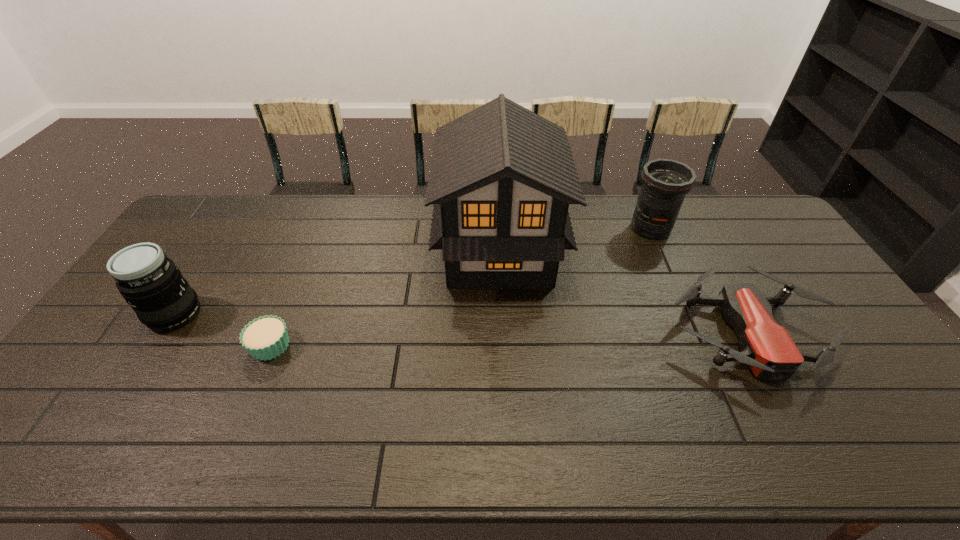
The width and height of the screenshot is (960, 540). In order to click on free space located on the front-facing side of the third object from left to right in this screenshot , I will do `click(408, 253)`.

Where is `blank space located on the right of the farther telephoto lens`? Image resolution: width=960 pixels, height=540 pixels. blank space located on the right of the farther telephoto lens is located at coordinates (716, 228).

Where is `vacant space situated 0.190m on the back of the leftmost object`? This screenshot has width=960, height=540. vacant space situated 0.190m on the back of the leftmost object is located at coordinates (213, 253).

The width and height of the screenshot is (960, 540). I want to click on free space located 0.090m on the front-facing side of the drone, so click(x=796, y=425).

Locate an element on the screen. The width and height of the screenshot is (960, 540). free region located 0.130m on the right of the second object from left to right is located at coordinates (340, 345).

Where is `dollhouse at the far edge`? The width and height of the screenshot is (960, 540). dollhouse at the far edge is located at coordinates (502, 177).

This screenshot has width=960, height=540. In order to click on telephoto lens that is at the far edge in this screenshot , I will do `click(665, 182)`.

The height and width of the screenshot is (540, 960). I want to click on object that is at the left edge, so [151, 283].

The width and height of the screenshot is (960, 540). Find the location of `object that is at the right edge`. object that is at the right edge is located at coordinates (767, 347).

The width and height of the screenshot is (960, 540). Identify the location of free space at the far edge of the desktop. (589, 217).